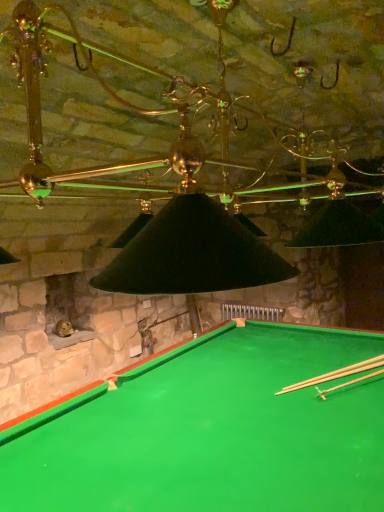
Question: Considering their positions, is smooth wood cue at bottom right, the 2th cue from the front, located in front of or behind light brown wooden cue at bottom right, placed as the 2th cue when sorted from back to front?

Choices:
 (A) front
 (B) behind

Answer: (B)

Question: Would you say smooth wood cue at bottom right, arranged as the first cue when viewed from the back, is to the left or to the right of light brown wooden cue at bottom right, which is counted as the 1th cue, starting from the front, in the picture?

Choices:
 (A) right
 (B) left

Answer: (B)

Question: Which object is the farthest from the smooth wood cue at bottom right, arranged as the first cue when viewed from the back?

Choices:
 (A) green felt billiard table at lower center
 (B) light brown wooden cue at bottom right, which is counted as the 1th cue, starting from the front

Answer: (A)

Question: Considering the real-world distances, which object is closest to the green felt billiard table at lower center?

Choices:
 (A) light brown wooden cue at bottom right, placed as the 2th cue when sorted from back to front
 (B) smooth wood cue at bottom right, the 2th cue from the front

Answer: (B)